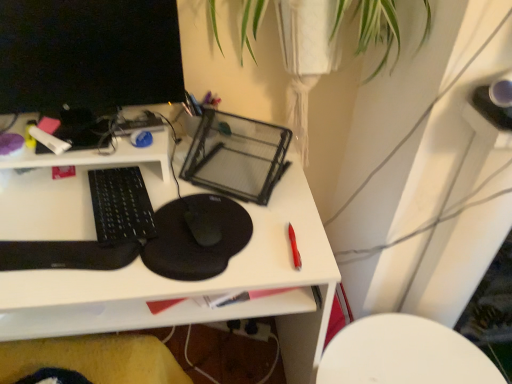
At what (x,y) coordinates should I click in order to perform the action: click on free space that is to the left of red plastic pen at right, which appears as the 1th stationery when viewed from the right. Please return your answer as a coordinate pair (x, y). The width and height of the screenshot is (512, 384). Looking at the image, I should click on (215, 238).